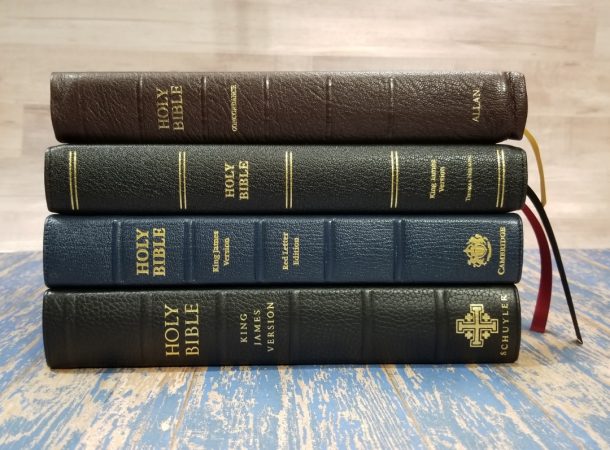
The height and width of the screenshot is (450, 610). I want to click on blue book, so click(x=360, y=264).